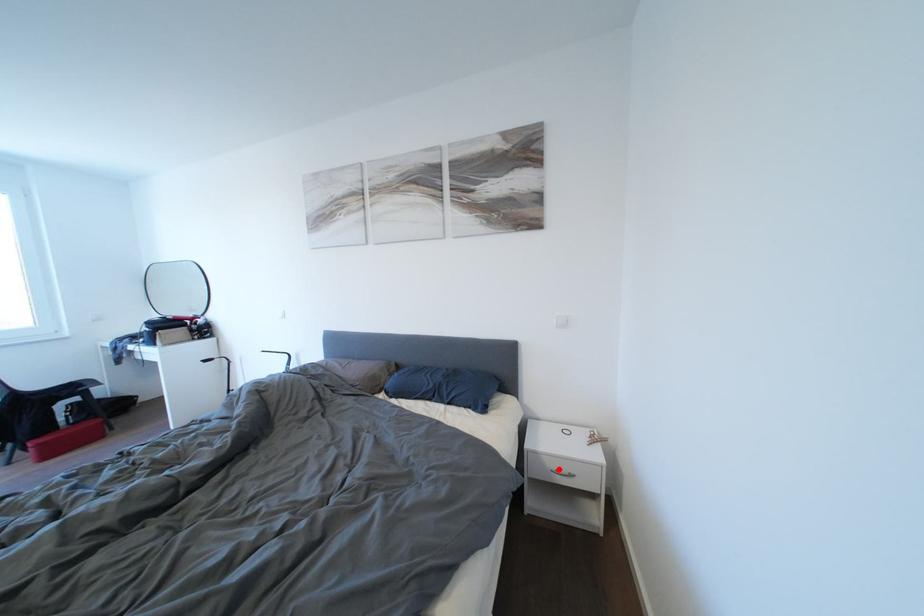
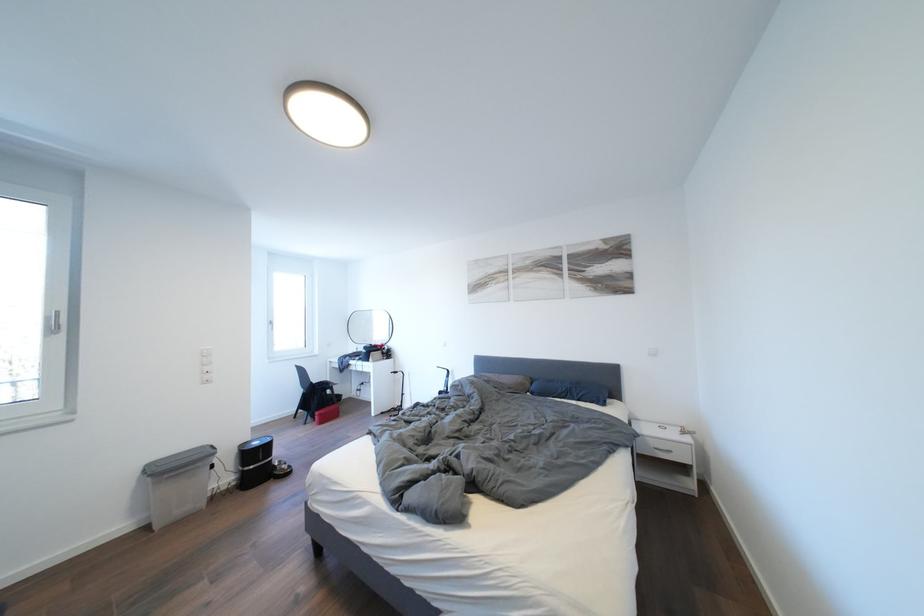
Locate, in the second image, the point that corresponds to the highlighted location in the first image.

(661, 448)